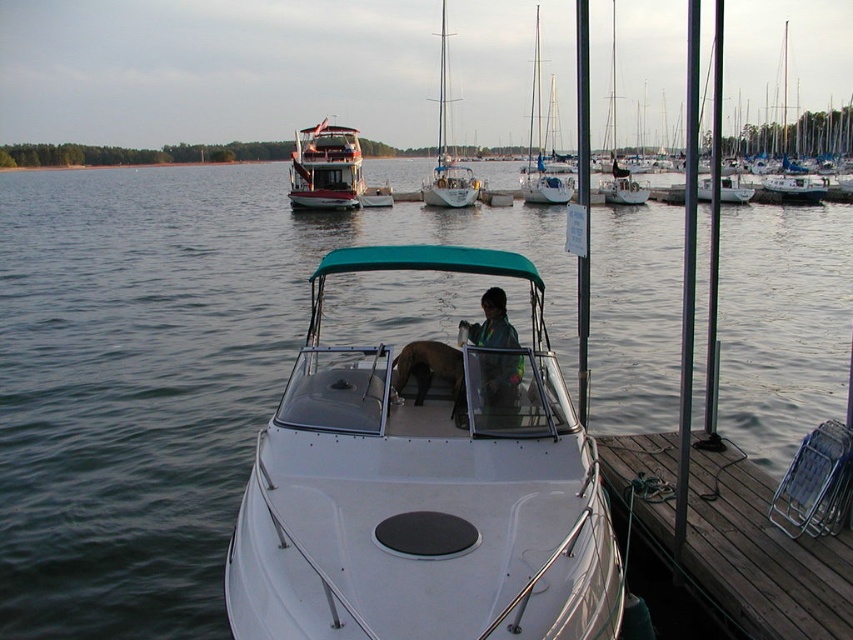
Between white glossy houseboat at upper center and white sailboat at center, which one has more height?

Standing taller between the two is white sailboat at center.

Is white glossy houseboat at upper center thinner than white sailboat at center?

Yes.

Does point (350, 193) lie in front of point (444, 92)?

Yes.

This screenshot has width=853, height=640. Identify the location of white glossy houseboat at upper center. (326, 168).

Is brown wooden dock at lower right to the right of white sailboat at upper center from the viewer's perspective?

In fact, brown wooden dock at lower right is to the left of white sailboat at upper center.

Consider the image. Is brown wooden dock at lower right below white sailboat at upper center?

Yes.

Does point (762, 570) come in front of point (540, 157)?

That is True.

The height and width of the screenshot is (640, 853). What are the coordinates of `brown wooden dock at lower right` in the screenshot? It's located at (759, 557).

Who is more distant from viewer, (428,500) or (473,326)?

Point (473,326)

In order to click on white glossy boat at center in this screenshot , I will do `click(422, 492)`.

Between point (378, 490) and point (473, 342), which one is positioned behind?

Positioned behind is point (473, 342).

The width and height of the screenshot is (853, 640). I want to click on white glossy boat at center, so click(x=422, y=492).